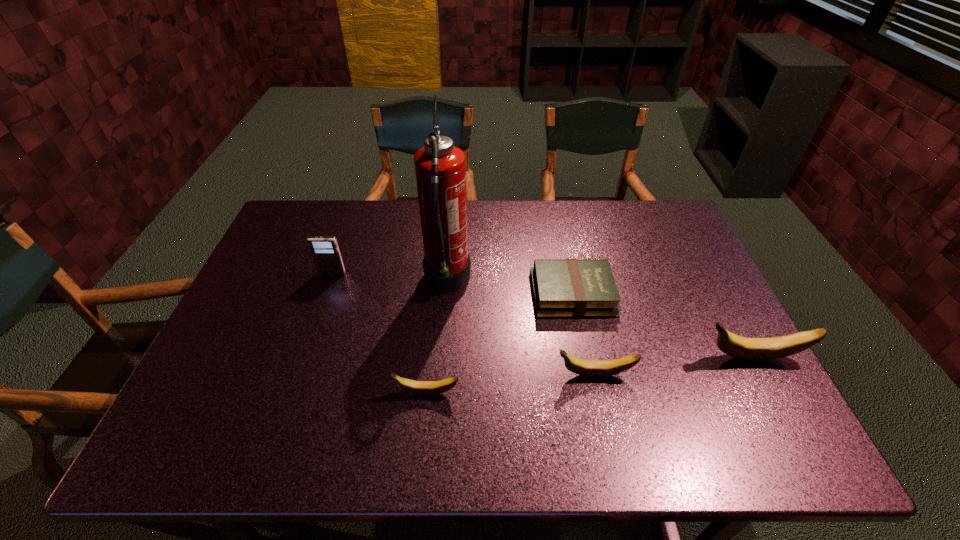
Locate an element on the screen. free spot between the nearest banana and the iPod is located at coordinates (379, 333).

Identify the location of free space between the nearest object and the tallest object. (437, 338).

At what (x,y) coordinates should I click in order to perform the action: click on vacant point located between the second shortest object and the leftmost object. Please return your answer as a coordinate pair (x, y). This screenshot has height=540, width=960. Looking at the image, I should click on (x=379, y=333).

Locate an element on the screen. This screenshot has height=540, width=960. free space between the fire extinguisher and the fifth farthest object is located at coordinates (521, 329).

In order to click on free spot between the shortest object and the second tallest banana in this screenshot , I will do `click(584, 334)`.

Where is `vacant area that lies between the tallest object and the shortest object`? Image resolution: width=960 pixels, height=540 pixels. vacant area that lies between the tallest object and the shortest object is located at coordinates (510, 288).

Locate an element on the screen. The image size is (960, 540). free spot between the fire extinguisher and the leftmost object is located at coordinates (390, 278).

Locate which object is the fourth closest to the iPod. Please provide its 2D coordinates. Your answer should be formatted as a tuple, i.e. [(x, y)], where the tuple contains the x and y coordinates of a point satisfying the conditions above.

[(590, 368)]

This screenshot has height=540, width=960. Identify the location of the fifth closest object relative to the tallest object. (750, 349).

Locate an element on the screen. Image resolution: width=960 pixels, height=540 pixels. banana that stands as the second closest to the nearest object is located at coordinates (750, 349).